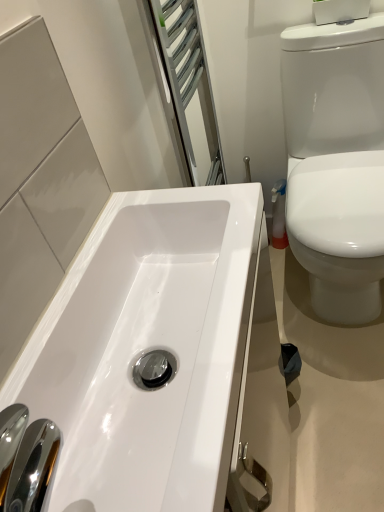
Question: Is white glossy toilet at right shorter than white glossy sink at lower left?

Choices:
 (A) yes
 (B) no

Answer: (B)

Question: Can white glossy sink at lower left be found inside white glossy toilet at right?

Choices:
 (A) no
 (B) yes

Answer: (A)

Question: From a real-world perspective, does white glossy toilet at right sit lower than white glossy sink at lower left?

Choices:
 (A) no
 (B) yes

Answer: (B)

Question: Are white glossy toilet at right and white glossy sink at lower left located far from each other?

Choices:
 (A) no
 (B) yes

Answer: (A)

Question: Considering the relative sizes of white glossy toilet at right and white glossy sink at lower left in the image provided, is white glossy toilet at right bigger than white glossy sink at lower left?

Choices:
 (A) no
 (B) yes

Answer: (B)

Question: Can you confirm if white glossy toilet at right is taller than white glossy sink at lower left?

Choices:
 (A) yes
 (B) no

Answer: (A)

Question: From the image's perspective, is white glossy sink at lower left beneath white glossy toilet at right?

Choices:
 (A) yes
 (B) no

Answer: (A)

Question: From a real-world perspective, is white glossy sink at lower left over white glossy toilet at right?

Choices:
 (A) no
 (B) yes

Answer: (B)

Question: Does white glossy sink at lower left contain white glossy toilet at right?

Choices:
 (A) yes
 (B) no

Answer: (B)

Question: From a real-world perspective, is white glossy sink at lower left under white glossy toilet at right?

Choices:
 (A) yes
 (B) no

Answer: (B)

Question: Is white glossy sink at lower left smaller than white glossy toilet at right?

Choices:
 (A) yes
 (B) no

Answer: (A)

Question: Does white glossy sink at lower left appear on the left side of white glossy toilet at right?

Choices:
 (A) yes
 (B) no

Answer: (A)

Question: Is point (319, 216) positioned closer to the camera than point (175, 475)?

Choices:
 (A) farther
 (B) closer

Answer: (A)